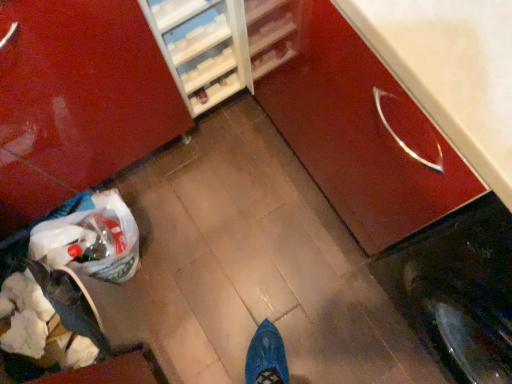
Identify the location of glossy wood cabinet at center right, the second cabinetry positioned from the left. (360, 130).

Measure the distance between white paper bag at lower left and glossy wood cabinet at center right, arranged as the first cabinetry when viewed from the right.

64.47 centimeters.

From the image's perspective, is white paper bag at lower left located beneath glossy wood cabinet at center right, arranged as the first cabinetry when viewed from the right?

Yes, from the image's perspective, white paper bag at lower left is beneath glossy wood cabinet at center right, arranged as the first cabinetry when viewed from the right.

Between white paper bag at lower left and glossy wood cabinet at center right, the second cabinetry positioned from the left, which one is positioned in front?

Positioned in front is glossy wood cabinet at center right, the second cabinetry positioned from the left.

From their relative heights in the image, would you say white paper bag at lower left is taller or shorter than glossy wood cabinet at center right, arranged as the first cabinetry when viewed from the right?

white paper bag at lower left is shorter than glossy wood cabinet at center right, arranged as the first cabinetry when viewed from the right.

From the image's perspective, is white paper bag at lower left on glossy wood cabinet at lower right, the 2th cabinetry when ordered from right to left?

No, from the image's perspective, white paper bag at lower left is not over glossy wood cabinet at lower right, the 2th cabinetry when ordered from right to left.

Is white paper bag at lower left positioned before glossy wood cabinet at lower right, arranged as the first cabinetry when viewed from the left?

No.

Considering the positions of objects white paper bag at lower left and glossy wood cabinet at lower right, arranged as the first cabinetry when viewed from the left, in the image provided, who is more to the right, white paper bag at lower left or glossy wood cabinet at lower right, arranged as the first cabinetry when viewed from the left,?

From the viewer's perspective, glossy wood cabinet at lower right, arranged as the first cabinetry when viewed from the left, appears more on the right side.

Is white paper bag at lower left taller or shorter than glossy wood cabinet at lower right, the 2th cabinetry when ordered from right to left?

In the image, white paper bag at lower left appears to be shorter than glossy wood cabinet at lower right, the 2th cabinetry when ordered from right to left.

Measure the distance from glossy wood cabinet at center right, arranged as the first cabinetry when viewed from the right, to glossy wood cabinet at lower right, arranged as the first cabinetry when viewed from the left.

A distance of 17.81 inches exists between glossy wood cabinet at center right, arranged as the first cabinetry when viewed from the right, and glossy wood cabinet at lower right, arranged as the first cabinetry when viewed from the left.

Considering the relative sizes of glossy wood cabinet at center right, arranged as the first cabinetry when viewed from the right, and glossy wood cabinet at lower right, arranged as the first cabinetry when viewed from the left, in the image provided, is glossy wood cabinet at center right, arranged as the first cabinetry when viewed from the right, bigger than glossy wood cabinet at lower right, arranged as the first cabinetry when viewed from the left,?

No.

From a real-world perspective, between glossy wood cabinet at center right, the second cabinetry positioned from the left, and glossy wood cabinet at lower right, arranged as the first cabinetry when viewed from the left, who is vertically lower?

glossy wood cabinet at lower right, arranged as the first cabinetry when viewed from the left.

Consider the image. Is glossy wood cabinet at center right, the second cabinetry positioned from the left, closer to the viewer compared to glossy wood cabinet at lower right, the 2th cabinetry when ordered from right to left?

Yes, it is in front of glossy wood cabinet at lower right, the 2th cabinetry when ordered from right to left.

Is glossy wood cabinet at center right, arranged as the first cabinetry when viewed from the right, aimed at white paper bag at lower left?

Yes, glossy wood cabinet at center right, arranged as the first cabinetry when viewed from the right, is aimed at white paper bag at lower left.

Would you consider glossy wood cabinet at center right, arranged as the first cabinetry when viewed from the right, to be distant from white paper bag at lower left?

Result: glossy wood cabinet at center right, arranged as the first cabinetry when viewed from the right, is near white paper bag at lower left, not far away.

Can white paper bag at lower left be found inside glossy wood cabinet at center right, arranged as the first cabinetry when viewed from the right?

No.

What's the angular difference between glossy wood cabinet at lower right, the 2th cabinetry when ordered from right to left, and glossy wood cabinet at center right, the second cabinetry positioned from the left,'s facing directions?

90.3 degrees separate the facing orientations of glossy wood cabinet at lower right, the 2th cabinetry when ordered from right to left, and glossy wood cabinet at center right, the second cabinetry positioned from the left.

Is glossy wood cabinet at lower right, arranged as the first cabinetry when viewed from the left, outside of glossy wood cabinet at center right, the second cabinetry positioned from the left?

Yes, glossy wood cabinet at lower right, arranged as the first cabinetry when viewed from the left, is not within glossy wood cabinet at center right, the second cabinetry positioned from the left.

Can you confirm if glossy wood cabinet at lower right, the 2th cabinetry when ordered from right to left, is thinner than glossy wood cabinet at center right, arranged as the first cabinetry when viewed from the right?

No, glossy wood cabinet at lower right, the 2th cabinetry when ordered from right to left, is not thinner than glossy wood cabinet at center right, arranged as the first cabinetry when viewed from the right.

Does glossy wood cabinet at lower right, arranged as the first cabinetry when viewed from the left, have a smaller size compared to white paper bag at lower left?

No.

Considering the relative positions of glossy wood cabinet at lower right, arranged as the first cabinetry when viewed from the left, and white paper bag at lower left in the image provided, is glossy wood cabinet at lower right, arranged as the first cabinetry when viewed from the left, to the right of white paper bag at lower left from the viewer's perspective?

Correct, you'll find glossy wood cabinet at lower right, arranged as the first cabinetry when viewed from the left, to the right of white paper bag at lower left.

Which is in front, glossy wood cabinet at lower right, arranged as the first cabinetry when viewed from the left, or white paper bag at lower left?

glossy wood cabinet at lower right, arranged as the first cabinetry when viewed from the left.

Is glossy wood cabinet at lower right, arranged as the first cabinetry when viewed from the left, turned away from white paper bag at lower left?

glossy wood cabinet at lower right, arranged as the first cabinetry when viewed from the left, is not turned away from white paper bag at lower left.

The height and width of the screenshot is (384, 512). Find the location of `garbage below the glossy wood cabinet at center right, the second cabinetry positioned from the left (from a real-world perspective)`. garbage below the glossy wood cabinet at center right, the second cabinetry positioned from the left (from a real-world perspective) is located at coordinates (63, 270).

The width and height of the screenshot is (512, 384). Identify the location of garbage located behind the glossy wood cabinet at lower right, the 2th cabinetry when ordered from right to left. (63, 270).

When comparing their distances from glossy wood cabinet at center right, arranged as the first cabinetry when viewed from the right, does white paper bag at lower left or glossy wood cabinet at lower right, the 2th cabinetry when ordered from right to left, seem further?

white paper bag at lower left lies further to glossy wood cabinet at center right, arranged as the first cabinetry when viewed from the right, than the other object.

From the image, which object appears to be nearer to glossy wood cabinet at center right, arranged as the first cabinetry when viewed from the right, glossy wood cabinet at lower right, arranged as the first cabinetry when viewed from the left, or white paper bag at lower left?

Among the two, glossy wood cabinet at lower right, arranged as the first cabinetry when viewed from the left, is located nearer to glossy wood cabinet at center right, arranged as the first cabinetry when viewed from the right.

Which object lies nearer to the anchor point white paper bag at lower left, glossy wood cabinet at lower right, the 2th cabinetry when ordered from right to left, or glossy wood cabinet at center right, arranged as the first cabinetry when viewed from the right?

glossy wood cabinet at lower right, the 2th cabinetry when ordered from right to left, lies closer to white paper bag at lower left than the other object.

From the image, which object appears to be nearer to white paper bag at lower left, glossy wood cabinet at center right, the second cabinetry positioned from the left, or glossy wood cabinet at lower right, arranged as the first cabinetry when viewed from the left?

Among the two, glossy wood cabinet at lower right, arranged as the first cabinetry when viewed from the left, is located nearer to white paper bag at lower left.

When comparing their distances from glossy wood cabinet at lower right, the 2th cabinetry when ordered from right to left, does glossy wood cabinet at center right, arranged as the first cabinetry when viewed from the right, or white paper bag at lower left seem closer?

Based on the image, white paper bag at lower left appears to be nearer to glossy wood cabinet at lower right, the 2th cabinetry when ordered from right to left.

Looking at the image, which one is located further to glossy wood cabinet at lower right, arranged as the first cabinetry when viewed from the left, white paper bag at lower left or glossy wood cabinet at center right, arranged as the first cabinetry when viewed from the right?

glossy wood cabinet at center right, arranged as the first cabinetry when viewed from the right.

In order to click on cabinetry situated between white paper bag at lower left and glossy wood cabinet at center right, the second cabinetry positioned from the left, from left to right in this screenshot , I will do `click(77, 100)`.